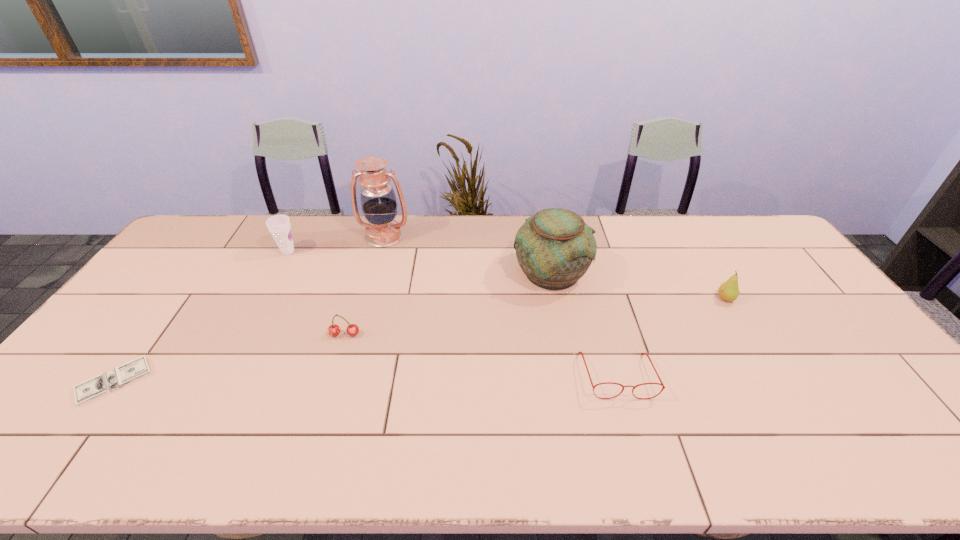
This screenshot has width=960, height=540. Identify the location of object located at the left edge. (105, 383).

This screenshot has width=960, height=540. Identify the location of vacant position at the far edge of the desktop. (632, 248).

You are a GUI agent. You are given a task and a screenshot of the screen. Output one action in this format:
    pyautogui.click(x=<x>, y=<y>)
    Task: Click on the vacant space at the left edge of the desktop
    The image size is (960, 540).
    Given the screenshot: What is the action you would take?
    pyautogui.click(x=169, y=306)

The width and height of the screenshot is (960, 540). I want to click on free point at the right edge, so click(x=842, y=338).

At what (x,y) coordinates should I click in order to perform the action: click on free space at the far left corner of the desktop. Please return your answer as a coordinate pair (x, y). Looking at the image, I should click on (204, 228).

Locate an element on the screen. The image size is (960, 540). vacant area at the near left corner of the desktop is located at coordinates (27, 445).

Where is `vacant point located between the dollar and the sixth tallest object`? vacant point located between the dollar and the sixth tallest object is located at coordinates (366, 379).

Image resolution: width=960 pixels, height=540 pixels. Find the location of `vacant region between the spectacles and the oil lamp`. vacant region between the spectacles and the oil lamp is located at coordinates (501, 306).

Find the location of a particular element. The image size is (960, 540). free space between the shortest object and the second object from left to right is located at coordinates (202, 316).

Locate an element on the screen. This screenshot has height=540, width=960. free space that is in between the spectacles and the fourth tallest object is located at coordinates (671, 337).